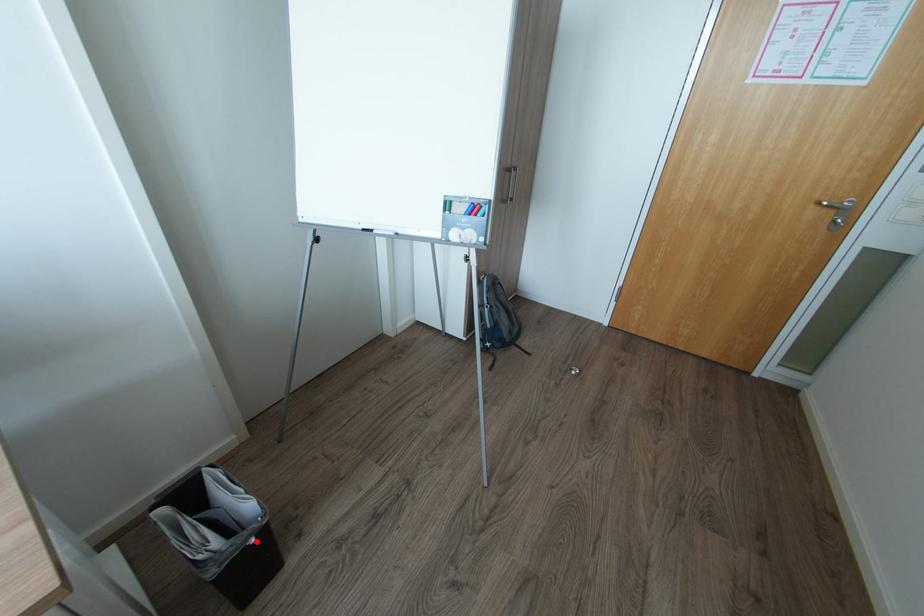
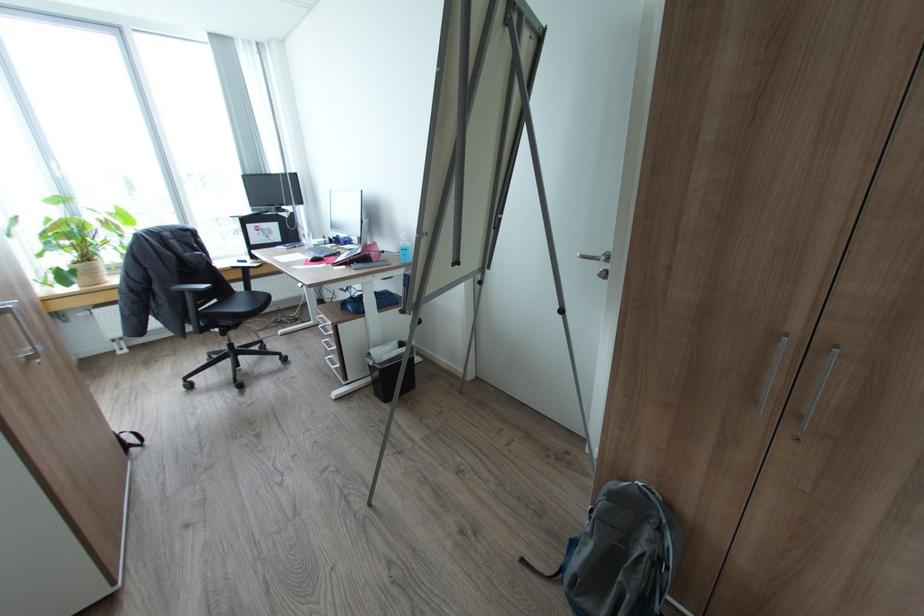
Question: I am providing you with two images of the same scene from different viewpoints. A red point is marked on the first image. Is the red point's position out of view in image 2?

Choices:
 (A) Yes
 (B) No

Answer: (B)